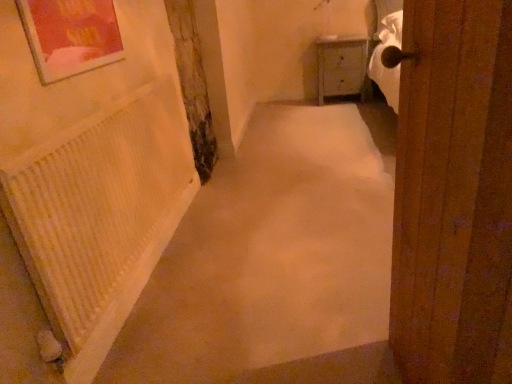
The width and height of the screenshot is (512, 384). Identify the location of free space above white textured radiator at left (from a real-world perspective). (92, 109).